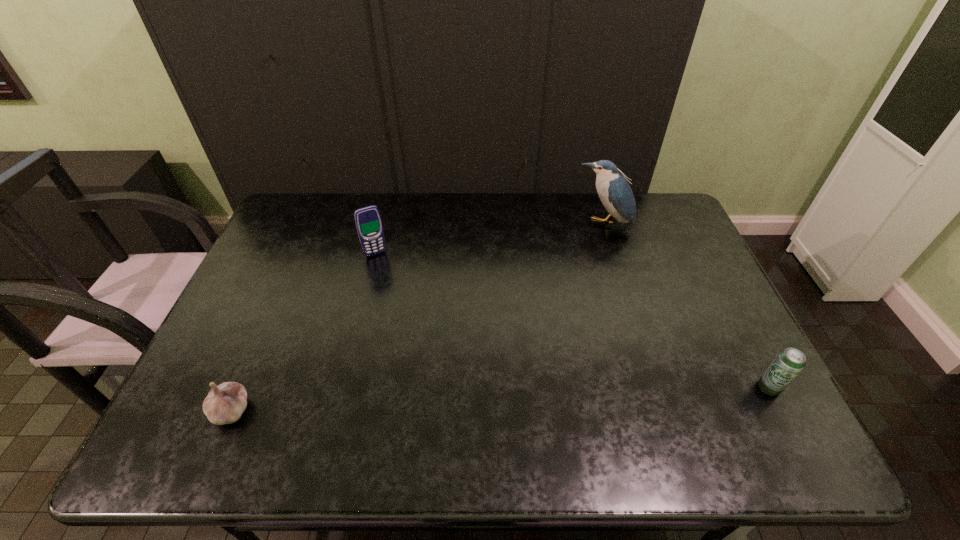
Where is `object that is at the near right corner`? This screenshot has width=960, height=540. object that is at the near right corner is located at coordinates (789, 362).

Image resolution: width=960 pixels, height=540 pixels. In the image, there is a desktop. In order to click on vacant space at the far edge in this screenshot , I will do `click(500, 204)`.

At what (x,y) coordinates should I click in order to perform the action: click on free spot at the near edge of the desktop. Please return your answer as a coordinate pair (x, y). The image size is (960, 540). Looking at the image, I should click on (400, 398).

Locate an element on the screen. vacant space at the left edge of the desktop is located at coordinates (x=279, y=255).

In the image, there is a desktop. At what (x,y) coordinates should I click in order to perform the action: click on vacant space at the right edge. Please return your answer as a coordinate pair (x, y). The image size is (960, 540). Looking at the image, I should click on (718, 357).

Where is `vacant area at the far left corner`? This screenshot has width=960, height=540. vacant area at the far left corner is located at coordinates (307, 212).

Locate an element on the screen. vacant space at the far right corner of the desktop is located at coordinates (660, 224).

I want to click on vacant region at the near right corner of the desktop, so click(x=745, y=386).

Image resolution: width=960 pixels, height=540 pixels. I want to click on vacant space in between the bird and the beer can, so (685, 306).

The image size is (960, 540). Find the location of `empty location between the third object from left to right and the garlic`. empty location between the third object from left to right and the garlic is located at coordinates (417, 317).